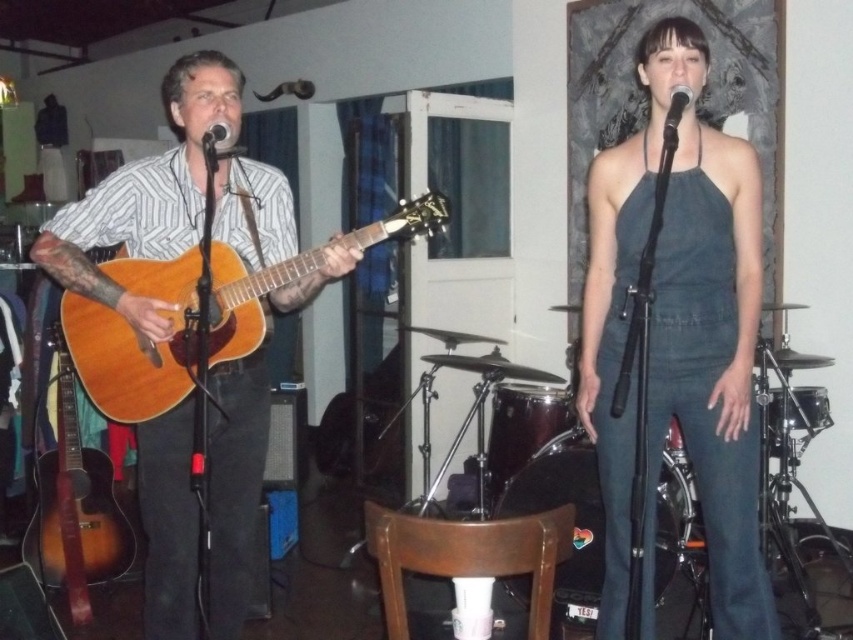
Can you confirm if black matte microphone at upper center is positioned to the right of black matte microphone at center?

Correct, you'll find black matte microphone at upper center to the right of black matte microphone at center.

Does black matte microphone at upper center have a greater width compared to black matte microphone at center?

Yes, black matte microphone at upper center is wider than black matte microphone at center.

The width and height of the screenshot is (853, 640). In order to click on black matte microphone at upper center in this screenshot , I will do `click(675, 115)`.

Does dark denim jumpsuit at center have a lesser height compared to black matte microphone at center?

Incorrect, dark denim jumpsuit at center's height does not fall short of black matte microphone at center's.

Who is more forward, [645,568] or [212,145]?

Point [212,145]

Locate an element on the screen. This screenshot has width=853, height=640. dark denim jumpsuit at center is located at coordinates (679, 339).

Which is in front, point (183, 502) or point (225, 125)?

Point (225, 125)

Can you confirm if matte wood guitar at left is wider than black matte microphone at center?

Yes.

Does point (164, 193) come closer to viewer compared to point (212, 134)?

That is False.

In order to click on matte wood guitar at left in this screenshot , I will do `click(148, 195)`.